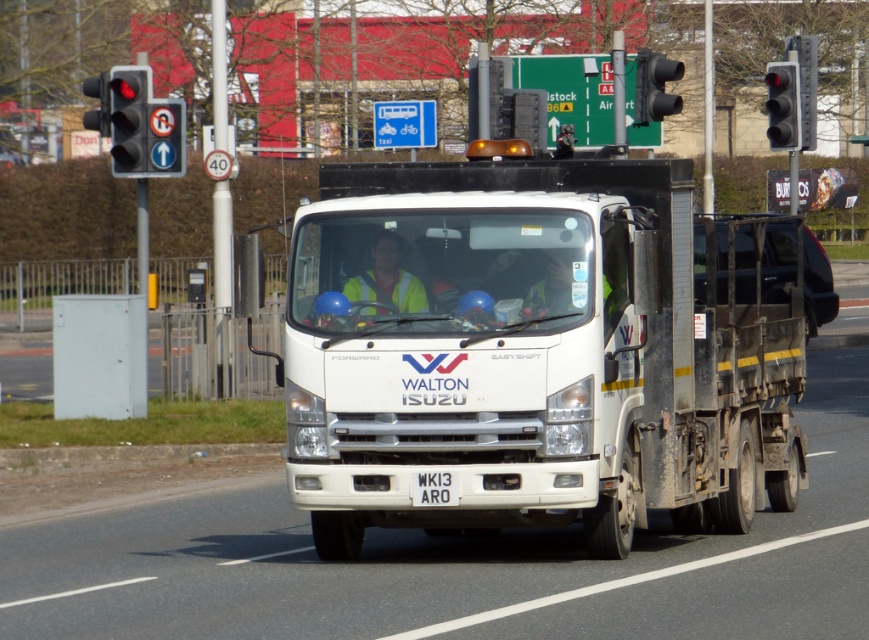
How much distance is there between white matte truck at center and yellow reflective safety vest at center?

white matte truck at center and yellow reflective safety vest at center are 1.32 meters apart from each other.

Is white matte truck at center bigger than yellow reflective safety vest at center?

Correct, white matte truck at center is larger in size than yellow reflective safety vest at center.

You are a GUI agent. You are given a task and a screenshot of the screen. Output one action in this format:
    pyautogui.click(x=<x>, y=<y>)
    Task: Click on the white matte truck at center
    
    Given the screenshot: What is the action you would take?
    pyautogui.click(x=536, y=352)

Measure the distance between white matte truck at center and camera.

They are 12.61 meters apart.

Between point (755, 356) and point (416, 472), which one is positioned in front?

Point (416, 472)

This screenshot has height=640, width=869. I want to click on white matte truck at center, so click(536, 352).

I want to click on white matte truck at center, so click(536, 352).

Is point (661, 100) positioned behind point (433, 484)?

Yes, point (661, 100) is behind point (433, 484).

Who is lower down, black plastic traffic light at upper right or white plastic license plate at center?

white plastic license plate at center

Who is more distant from viewer, (644,90) or (416,481)?

The point (644,90) is behind.

What are the coordinates of `black plastic traffic light at upper right` in the screenshot? It's located at (655, 86).